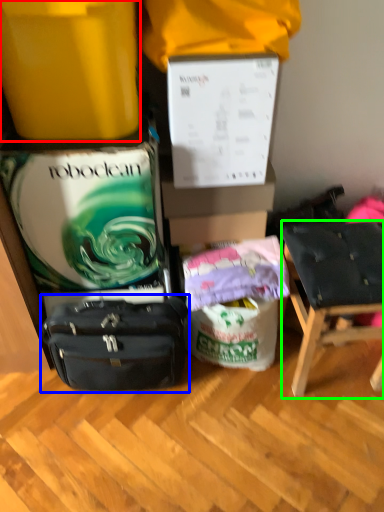
Question: Considering the real-world distances, which object is closest to box (highlighted by a red box)? luggage and bags (highlighted by a blue box) or chair (highlighted by a green box).

Choices:
 (A) luggage and bags
 (B) chair

Answer: (A)